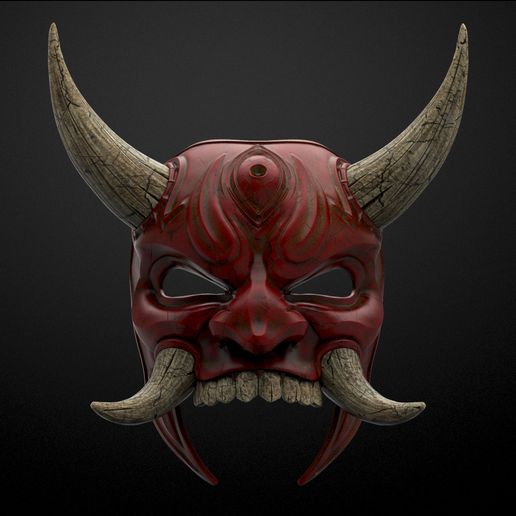
This screenshot has height=516, width=516. What are the coordinates of `eye hole` in the screenshot? It's located at (180, 288), (328, 284).